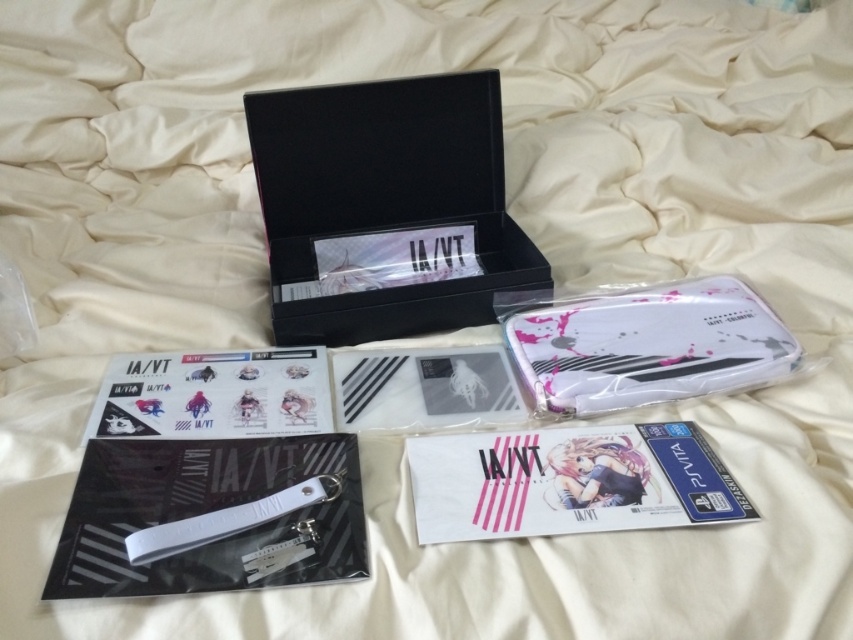
Between point (558, 362) and point (233, 369), which one is positioned behind?

Positioned behind is point (233, 369).

The height and width of the screenshot is (640, 853). I want to click on white matte plastic case at center, so click(648, 346).

Who is more distant from viewer, (604, 432) or (616, 317)?

The point (616, 317) is behind.

At what (x,y) coordinates should I click in order to perform the action: click on white matte card game at center. Please return your answer as a coordinate pair (x, y). The image size is (853, 640). Looking at the image, I should click on (567, 481).

Where is `white matte card game at center`? white matte card game at center is located at coordinates (567, 481).

The image size is (853, 640). Find the location of `black matte box at upper center`. black matte box at upper center is located at coordinates (386, 208).

Measure the distance between point (491, 154) and camera.

A distance of 3.64 feet exists between point (491, 154) and camera.

Identify the location of black matte box at upper center. This screenshot has height=640, width=853. (386, 208).